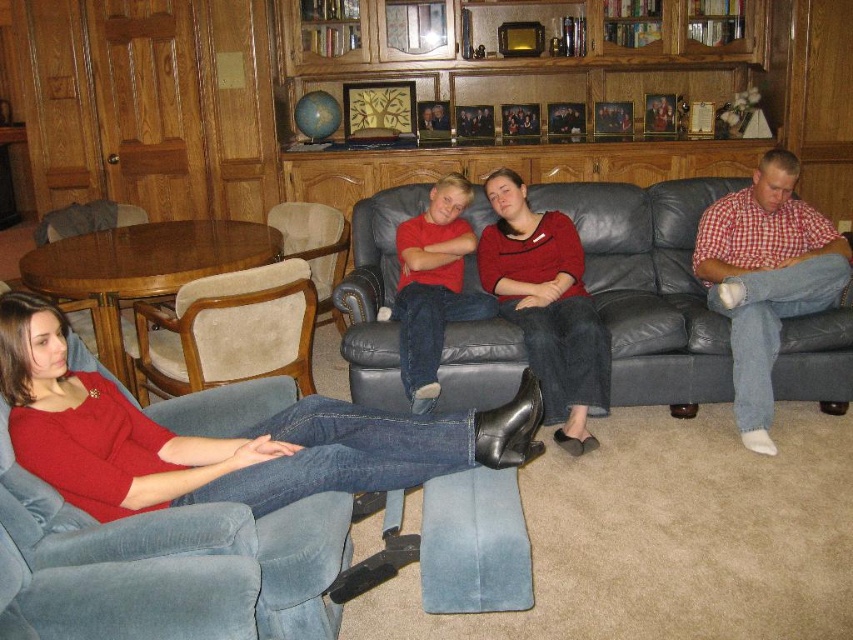
You are organizing a clothing donation drive and need to sort items by size. You have two items labeled as matte red sweater at lower left and matte red sweater at center. Which one should you place in the small size bin?

The matte red sweater at lower left should be placed in the small size bin since it has a smaller size compared to the matte red sweater at center.

You are standing in the living room and want to place a small table between the two points marked as point (775, 193) and point (209, 353). Which point is closer to you so that the table can be placed appropriately?

Point (775, 193) is closer to you than point (209, 353), so you should position the table closer to the point (775, 193) to ensure it is accessible.